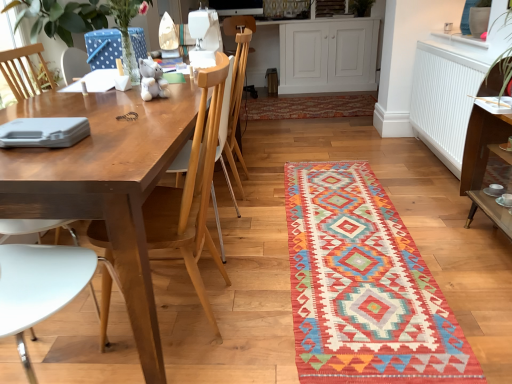
Consider the image. What is the approximate width of white wood cabinet at upper center?

It is 28.60 inches.

In order to click on multicolored woven mat at center in this screenshot , I will do `click(364, 286)`.

This screenshot has width=512, height=384. What do you see at coordinates (364, 286) in the screenshot?
I see `multicolored woven mat at center` at bounding box center [364, 286].

I want to click on white wood cabinet at upper center, so click(328, 56).

Between point (158, 234) and point (236, 72), which one is positioned behind?

The point (236, 72) is farther.

In terms of size, does wooden chair at left appear bigger or smaller than wooden chair at center?

wooden chair at left is smaller than wooden chair at center.

Considering the relative sizes of wooden chair at left and wooden chair at center in the image provided, is wooden chair at left wider than wooden chair at center?

No, wooden chair at left is not wider than wooden chair at center.

Can you tell me how much wooden chair at left and wooden chair at center differ in facing direction?

3.99 degrees.

Is multicolored woven mat at center positioned with its back to white wood cabinet at upper center?

No, multicolored woven mat at center is not facing the opposite direction of white wood cabinet at upper center.

Is multicolored woven mat at center positioned beyond the bounds of white wood cabinet at upper center?

Yes, multicolored woven mat at center is outside of white wood cabinet at upper center.

Consider the image. Does multicolored woven mat at center have a greater height compared to white wood cabinet at upper center?

Incorrect, the height of multicolored woven mat at center is not larger of that of white wood cabinet at upper center.

Where is `mat located in front of the white wood cabinet at upper center`? This screenshot has width=512, height=384. mat located in front of the white wood cabinet at upper center is located at coordinates (364, 286).

Which is in front, point (189, 147) or point (292, 80)?

Positioned in front is point (189, 147).

Considering their positions, is wooden chair at center located in front of or behind white wood cabinet at upper center?

Clearly, wooden chair at center is in front of white wood cabinet at upper center.

Looking at this image, considering the sizes of wooden chair at center and white wood cabinet at upper center in the image, is wooden chair at center bigger or smaller than white wood cabinet at upper center?

In the image, wooden chair at center appears to be smaller than white wood cabinet at upper center.

How different are the orientations of wooden chair at center and white wood cabinet at upper center in degrees?

90.6 degrees separate the facing orientations of wooden chair at center and white wood cabinet at upper center.

Which point is more distant from viewer, (369, 41) or (169, 244)?

Positioned behind is point (369, 41).

Looking at this image, how far apart are white wood cabinet at upper center and wooden chair at left?

They are 3.61 meters apart.

Does white wood cabinet at upper center appear on the left side of wooden chair at left?

Incorrect, white wood cabinet at upper center is not on the left side of wooden chair at left.

Is wooden chair at left wider than white matte radiator at upper right?

Yes.

From the picture: Between wooden chair at left and white matte radiator at upper right, which one is positioned in front?

Positioned in front is wooden chair at left.

Considering the relative positions of wooden chair at left and white matte radiator at upper right in the image provided, is wooden chair at left to the right of white matte radiator at upper right from the viewer's perspective?

No.

What's the angular difference between wooden chair at left and white matte radiator at upper right's facing directions?

3.45 degrees separate the facing orientations of wooden chair at left and white matte radiator at upper right.

Would you say wooden chair at left is inside or outside multicolored woven mat at center?

wooden chair at left is not inside multicolored woven mat at center, it's outside.

Between wooden chair at left and multicolored woven mat at center, which one is positioned behind?

multicolored woven mat at center.

Which object is positioned more to the right, wooden chair at left or multicolored woven mat at center?

Positioned to the right is multicolored woven mat at center.

Consider the image. Considering the positions of objects wooden chair at left and white wood cabinet at upper center in the image provided, who is in front, wooden chair at left or white wood cabinet at upper center?

wooden chair at left is more forward.

Consider the image. Is wooden chair at left located outside white wood cabinet at upper center?

Yes, wooden chair at left is outside of white wood cabinet at upper center.

Who is bigger, wooden chair at left or white wood cabinet at upper center?

Bigger between the two is white wood cabinet at upper center.

The image size is (512, 384). What are the coordinates of `cabinetry that is above the wooden chair at left (from the image's perspective)` in the screenshot? It's located at (328, 56).

Locate an element on the screen. The image size is (512, 384). chair in front of the wooden chair at center is located at coordinates (192, 191).

Where is `mat below the white wood cabinet at upper center (from a real-world perspective)`? The width and height of the screenshot is (512, 384). mat below the white wood cabinet at upper center (from a real-world perspective) is located at coordinates (364, 286).

Consider the image. When comparing their distances from wooden chair at left, does wooden chair at center or white matte radiator at upper right seem closer?

wooden chair at center lies closer to wooden chair at left than the other object.

Estimate the real-world distances between objects in this image. Which object is closer to wooden chair at center, white wood cabinet at upper center or wooden chair at left?

wooden chair at left lies closer to wooden chair at center than the other object.

From the image, which object appears to be farther from white wood cabinet at upper center, wooden chair at center or white matte radiator at upper right?

Among the two, wooden chair at center is located further to white wood cabinet at upper center.

From the image, which object appears to be farther from white matte radiator at upper right, wooden chair at center or white wood cabinet at upper center?

white wood cabinet at upper center lies further to white matte radiator at upper right than the other object.

Which object lies further to the anchor point wooden chair at left, multicolored woven mat at center or white wood cabinet at upper center?

→ Among the two, white wood cabinet at upper center is located further to wooden chair at left.

Considering their positions, is multicolored woven mat at center positioned further to wooden chair at center than white matte radiator at upper right?

white matte radiator at upper right.

From the image, which object appears to be nearer to multicolored woven mat at center, wooden chair at left or wooden chair at center?

Among the two, wooden chair at left is located nearer to multicolored woven mat at center.

From the image, which object appears to be nearer to white matte radiator at upper right, multicolored woven mat at center or wooden chair at left?

The object closer to white matte radiator at upper right is multicolored woven mat at center.

Locate an element on the screen. armchair located between white matte radiator at upper right and white wood cabinet at upper center in the depth direction is located at coordinates (233, 112).

Locate an element on the screen. mat between wooden chair at left and wooden chair at center from front to back is located at coordinates (364, 286).

I want to click on mat between wooden chair at center and white matte radiator at upper right from left to right, so click(x=364, y=286).

Find the location of `mat between wooden chair at left and white wood cabinet at upper center in the front-back direction`. mat between wooden chair at left and white wood cabinet at upper center in the front-back direction is located at coordinates (364, 286).